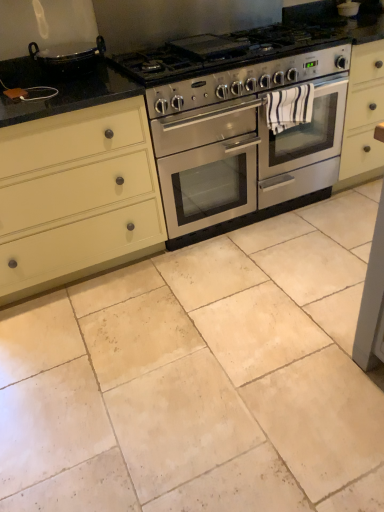
What do you see at coordinates (289, 106) in the screenshot?
I see `white striped towel at center` at bounding box center [289, 106].

Image resolution: width=384 pixels, height=512 pixels. What do you see at coordinates (76, 196) in the screenshot?
I see `matte cream cabinet at left` at bounding box center [76, 196].

What do you see at coordinates (245, 157) in the screenshot?
I see `stainless steel oven at center` at bounding box center [245, 157].

You are a GUI agent. You are given a task and a screenshot of the screen. Output one action in this format:
    pyautogui.click(x=<x>, y=<y>)
    Task: Click on the black granite countertop at center
    The image size is (384, 512).
    Given the screenshot: What is the action you would take?
    pyautogui.click(x=125, y=24)

At what (x,y) coordinates should I click in order to perform the action: click on beige stone tile at center. Please return your answer as a coordinate pair (x, y). This screenshot has width=384, height=512. Looking at the image, I should click on pos(201,377).

What is the approximate height of beige stone tile at center?

5.07 centimeters.

Find the location of a particular element. white striped towel at center is located at coordinates (289, 106).

Considering the sizes of objects beige stone tile at center and white striped towel at center in the image provided, who is wider, beige stone tile at center or white striped towel at center?

beige stone tile at center.

Based on the photo, looking at the image, does beige stone tile at center seem bigger or smaller compared to white striped towel at center?

Considering their sizes, beige stone tile at center takes up more space than white striped towel at center.

Considering the relative sizes of beige stone tile at center and white striped towel at center in the image provided, is beige stone tile at center shorter than white striped towel at center?

Indeed, beige stone tile at center has a lesser height compared to white striped towel at center.

From the picture: Is white striped towel at center surrounded by beige stone tile at center?

Actually, white striped towel at center is outside beige stone tile at center.

Is matte cream cabinet at left at the back of white striped towel at center?

No, white striped towel at center is not facing away from matte cream cabinet at left.

Is white striped towel at center in front of or behind matte cream cabinet at left in the image?

Visually, white striped towel at center is located behind matte cream cabinet at left.

Are white striped towel at center and matte cream cabinet at left beside each other?

There is a gap between white striped towel at center and matte cream cabinet at left.

From a real-world perspective, who is located lower, white striped towel at center or matte cream cabinet at left?

In real-world perspective, matte cream cabinet at left is lower.

Is beige stone tile at center behind black granite countertop at center?

No, it is not.

Considering the relative sizes of beige stone tile at center and black granite countertop at center in the image provided, is beige stone tile at center bigger than black granite countertop at center?

Yes.

From the image's perspective, is beige stone tile at center under black granite countertop at center?

Yes.

How many degrees apart are the facing directions of beige stone tile at center and black granite countertop at center?

The facing directions of beige stone tile at center and black granite countertop at center are 90.1 degrees apart.

Which object is wider, white striped towel at center or beige stone tile at center?

Wider between the two is beige stone tile at center.

Considering the sizes of white striped towel at center and beige stone tile at center in the image, is white striped towel at center bigger or smaller than beige stone tile at center?

Considering their sizes, white striped towel at center takes up less space than beige stone tile at center.

There is a beige stone tile at center. Identify the location of material above it (from a real-world perspective). This screenshot has height=512, width=384. (289, 106).

Considering the relative positions of black granite countertop at center and stainless steel oven at center in the image provided, is black granite countertop at center to the left of stainless steel oven at center from the viewer's perspective?

Correct, you'll find black granite countertop at center to the left of stainless steel oven at center.

From the image's perspective, which is above, black granite countertop at center or stainless steel oven at center?

black granite countertop at center.

How many degrees apart are the facing directions of black granite countertop at center and stainless steel oven at center?

The facing directions of black granite countertop at center and stainless steel oven at center are 0.00138 degrees apart.

Would you consider black granite countertop at center to be distant from stainless steel oven at center?

Answer: black granite countertop at center is actually quite close to stainless steel oven at center.

From the image's perspective, would you say matte cream cabinet at left is shown under beige stone tile at center?

No, from the image's perspective, matte cream cabinet at left is not below beige stone tile at center.

Locate an element on the screen. cabinetry above the beige stone tile at center (from the image's perspective) is located at coordinates (76, 196).

From a real-world perspective, who is located lower, matte cream cabinet at left or beige stone tile at center?

beige stone tile at center, from a real-world perspective.

Is black granite countertop at center facing towards matte cream cabinet at left?

No, black granite countertop at center is not aimed at matte cream cabinet at left.

Does black granite countertop at center have a greater height compared to matte cream cabinet at left?

Incorrect, the height of black granite countertop at center is not larger of that of matte cream cabinet at left.

In the scene shown: Can you confirm if black granite countertop at center is positioned to the right of matte cream cabinet at left?

Yes, black granite countertop at center is to the right of matte cream cabinet at left.

What are the coordinates of `ceramic tile on the left of white striped towel at center` in the screenshot? It's located at (201, 377).

This screenshot has height=512, width=384. Find the location of `material above the matte cream cabinet at left (from a real-world perspective)`. material above the matte cream cabinet at left (from a real-world perspective) is located at coordinates (289, 106).

Considering their positions, is matte cream cabinet at left positioned further to black granite countertop at center than white striped towel at center?

Among the two, white striped towel at center is located further to black granite countertop at center.

When comparing their distances from beige stone tile at center, does stainless steel oven at center or matte cream cabinet at left seem closer?

matte cream cabinet at left is closer to beige stone tile at center.

Which object lies nearer to the anchor point black granite countertop at center, matte cream cabinet at left or stainless steel oven at center?

matte cream cabinet at left.

When comparing their distances from stainless steel oven at center, does white striped towel at center or beige stone tile at center seem further?

The object further to stainless steel oven at center is beige stone tile at center.

Consider the image. From the image, which object appears to be farther from white striped towel at center, matte cream cabinet at left or black granite countertop at center?

Among the two, matte cream cabinet at left is located further to white striped towel at center.

Which object lies nearer to the anchor point beige stone tile at center, white striped towel at center or black granite countertop at center?

The object closer to beige stone tile at center is white striped towel at center.

From the image, which object appears to be farther from matte cream cabinet at left, white striped towel at center or beige stone tile at center?

white striped towel at center is further to matte cream cabinet at left.

From the image, which object appears to be nearer to white striped towel at center, black granite countertop at center or matte cream cabinet at left?

Based on the image, black granite countertop at center appears to be nearer to white striped towel at center.

Find the location of `oven between black granite countertop at center and beige stone tile at center vertically`. oven between black granite countertop at center and beige stone tile at center vertically is located at coordinates (245, 157).

Image resolution: width=384 pixels, height=512 pixels. Identify the location of ceramic tile between matte cream cabinet at left and white striped towel at center in the horizontal direction. click(201, 377).

Where is `material between black granite countertop at center and beige stone tile at center from top to bottom`? material between black granite countertop at center and beige stone tile at center from top to bottom is located at coordinates (289, 106).

Locate an element on the screen. countertop located between matte cream cabinet at left and stainless steel oven at center in the left-right direction is located at coordinates (125, 24).